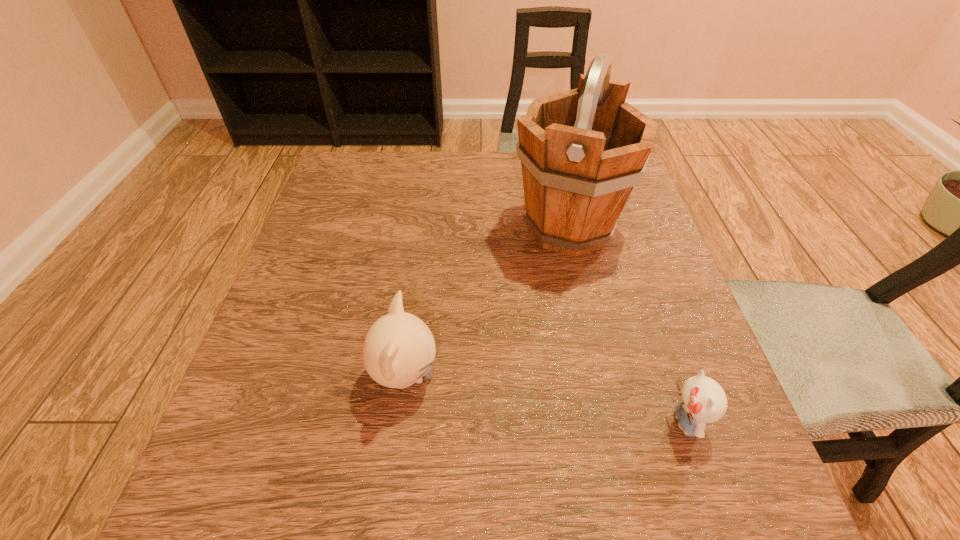
You are a GUI agent. You are given a task and a screenshot of the screen. Output one action in this format:
    pyautogui.click(x=<x>, y=<y>)
    Task: Click on the free area in between the farthest object and the taller kitten
    The image size is (960, 540).
    Given the screenshot: What is the action you would take?
    pyautogui.click(x=487, y=302)

The image size is (960, 540). Find the location of `unoccupied area between the left kitten and the farthest object`. unoccupied area between the left kitten and the farthest object is located at coordinates tap(487, 302).

At what (x,y) coordinates should I click in order to perform the action: click on empty space between the bucket and the shortest object. Please return your answer as a coordinate pair (x, y). The image size is (960, 540). Looking at the image, I should click on (627, 325).

The image size is (960, 540). I want to click on unoccupied area between the shorter kitten and the farthest object, so click(627, 325).

The height and width of the screenshot is (540, 960). In order to click on free point between the bucket and the second shortest object in this screenshot , I will do `click(487, 302)`.

The image size is (960, 540). In order to click on free space between the bucket and the shorter kitten in this screenshot , I will do `click(627, 325)`.

Where is `free point between the shortest object and the leftmost object`? free point between the shortest object and the leftmost object is located at coordinates (545, 399).

Find the location of `free spot between the tallest object and the shorter kitten`. free spot between the tallest object and the shorter kitten is located at coordinates (627, 325).

The width and height of the screenshot is (960, 540). What are the coordinates of `free space between the second tallest object and the bucket` in the screenshot? It's located at (487, 302).

Locate an element on the screen. This screenshot has width=960, height=540. free space between the farthest object and the shorter kitten is located at coordinates (627, 325).